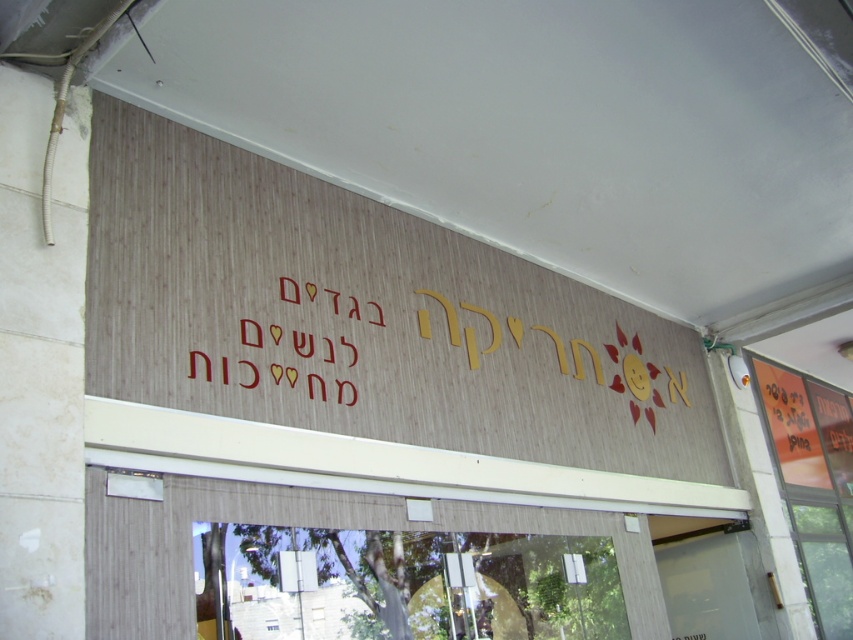
You are a delivery person holding a package that requires a 1.5 meter clearance to deliver. You see the wooden signboard at upper center and the transparent glass door at lower center. Can you pass the package through the space between them without tilting it?

The wooden signboard at upper center and transparent glass door at lower center are 1.49 meters apart from each other. Since the required clearance is 1.5 meters, the package cannot pass through the space between them without tilting it.

You are standing in front of the storefront and want to enter through the transparent glass door at lower center. To do so, you need to walk around the wooden signboard at upper center. Which direction should you move to reach the door?

The wooden signboard at upper center is positioned on the left side of the transparent glass door at lower center. Therefore, you should move to the right to go around the signboard and reach the door.

You are a delivery person trying to deliver a package to the store. The package is too large to fit through the transparent glass door at lower center. Can you place it under the wooden signboard at upper center?

The wooden signboard at upper center is much taller than the transparent glass door at lower center, so it might be possible to place the package under it. However, since the signboard is above the entrance, placing a large package there might not be feasible due to its height and positioning. Consider checking for another entrance or contacting the store for assistance.